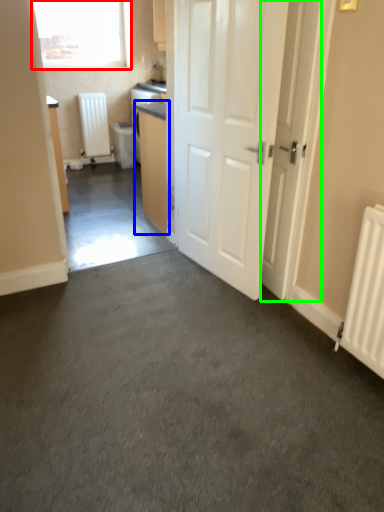
Question: Considering the real-world distances, which object is closest to window (highlighted by a red box)? cabinetry (highlighted by a blue box) or door (highlighted by a green box).

Choices:
 (A) cabinetry
 (B) door

Answer: (A)